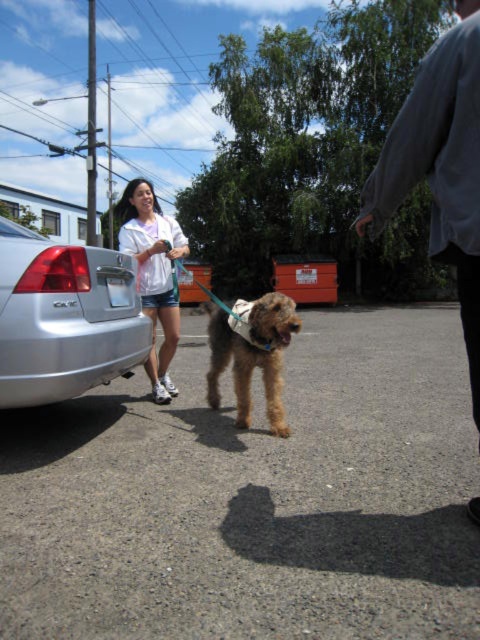
You are a fashion designer looking at the scene. You need to decide which item of clothing or accessory has a greater width between the white fabric jacket at upper center and the fuzzy brown dog at center. Which one is wider?

The white fabric jacket at upper center has a greater width than the fuzzy brown dog at center according to the description.